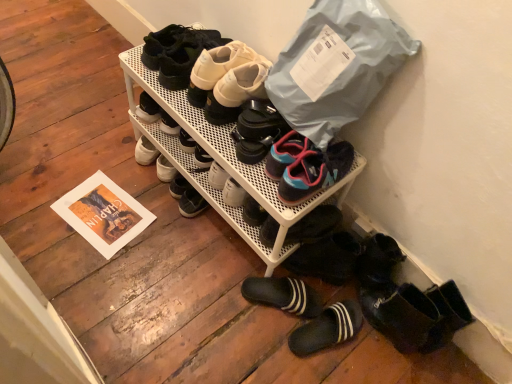
Where is `blank space to the left of black rubber slipper at lower center, which is the second footwear from bottom to top`? The height and width of the screenshot is (384, 512). blank space to the left of black rubber slipper at lower center, which is the second footwear from bottom to top is located at coordinates (213, 278).